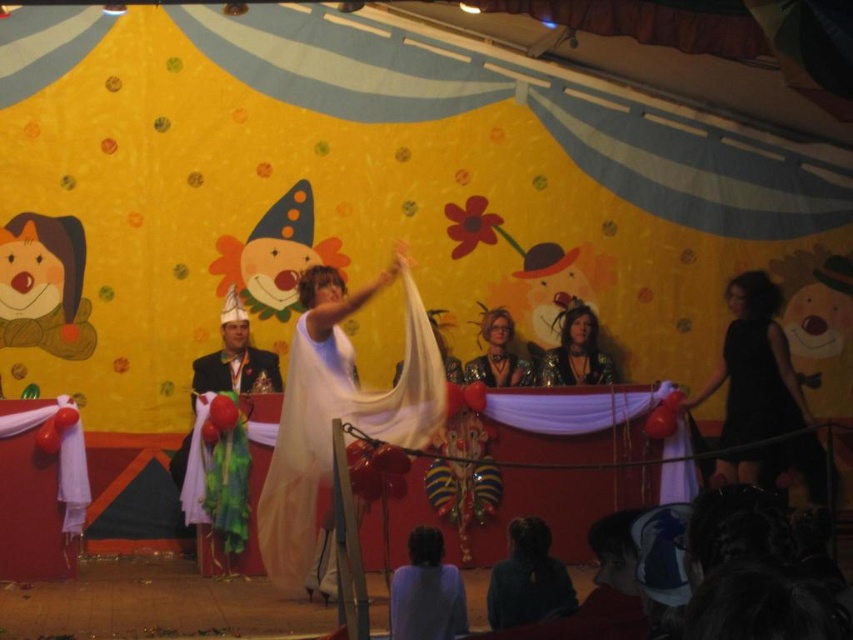
Can you confirm if black satin dress at right is taller than shiny black dress at center?

Correct, black satin dress at right is much taller as shiny black dress at center.

Which is behind, point (769, 460) or point (474, 360)?

The point (474, 360) is more distant.

What do you see at coordinates (755, 365) in the screenshot? I see `black satin dress at right` at bounding box center [755, 365].

The width and height of the screenshot is (853, 640). In order to click on black satin dress at right in this screenshot , I will do `click(755, 365)`.

Does shiny metallic necklace at center appear under shiny black dress at center?

Incorrect, shiny metallic necklace at center is not positioned below shiny black dress at center.

Describe the element at coordinates (576, 352) in the screenshot. The height and width of the screenshot is (640, 853). I see `shiny metallic necklace at center` at that location.

The height and width of the screenshot is (640, 853). In order to click on shiny metallic necklace at center in this screenshot , I will do `click(576, 352)`.

Is dark fabric at lower center below shiny black dress at center?

Yes, dark fabric at lower center is below shiny black dress at center.

Is point (520, 570) more distant than point (490, 353)?

No.

Measure the distance between point (520, 531) and camera.

Point (520, 531) and camera are 4.72 meters apart.

What are the coordinates of `dark fabric at lower center` in the screenshot? It's located at (527, 579).